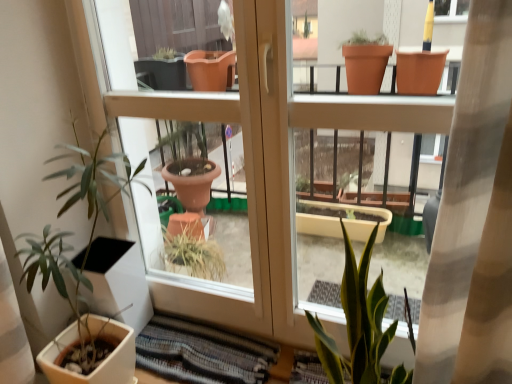
Question: Is striped fabric rug at lower center located outside green matte plant at left?

Choices:
 (A) yes
 (B) no

Answer: (A)

Question: Are striped fabric rug at lower center and green matte plant at left far apart?

Choices:
 (A) yes
 (B) no

Answer: (B)

Question: Would you say striped fabric rug at lower center contains green matte plant at left?

Choices:
 (A) yes
 (B) no

Answer: (B)

Question: Can you confirm if striped fabric rug at lower center is positioned to the left of green matte plant at left?

Choices:
 (A) no
 (B) yes

Answer: (A)

Question: Is green matte plant at left at the back of striped fabric rug at lower center?

Choices:
 (A) no
 (B) yes

Answer: (A)

Question: Is point (77, 173) positioned closer to the camera than point (246, 192)?

Choices:
 (A) closer
 (B) farther

Answer: (B)

Question: Visually, is green matte plant at left positioned to the left or to the right of matte brown screen door at lower left?

Choices:
 (A) left
 (B) right

Answer: (A)

Question: From their relative heights in the image, would you say green matte plant at left is taller or shorter than matte brown screen door at lower left?

Choices:
 (A) short
 (B) tall

Answer: (A)

Question: From a real-world perspective, relative to matte brown screen door at lower left, is green matte plant at left vertically above or below?

Choices:
 (A) above
 (B) below

Answer: (B)

Question: In terms of size, does striped fabric rug at lower center appear bigger or smaller than green matte plant at left?

Choices:
 (A) big
 (B) small

Answer: (B)

Question: Is striped fabric rug at lower center situated inside green matte plant at left or outside?

Choices:
 (A) inside
 (B) outside

Answer: (B)

Question: Relative to green matte plant at left, is striped fabric rug at lower center in front or behind?

Choices:
 (A) behind
 (B) front

Answer: (A)

Question: Is striped fabric rug at lower center taller or shorter than green matte plant at left?

Choices:
 (A) short
 (B) tall

Answer: (A)

Question: Is matte brown screen door at lower left inside the boundaries of green matte plant at left, or outside?

Choices:
 (A) inside
 (B) outside

Answer: (B)

Question: From their relative heights in the image, would you say matte brown screen door at lower left is taller or shorter than green matte plant at left?

Choices:
 (A) short
 (B) tall

Answer: (B)